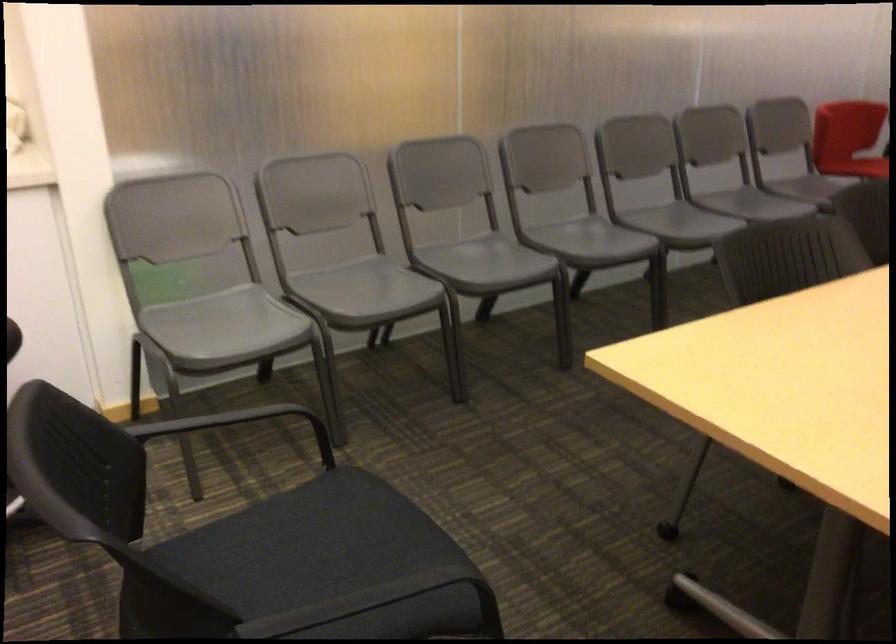
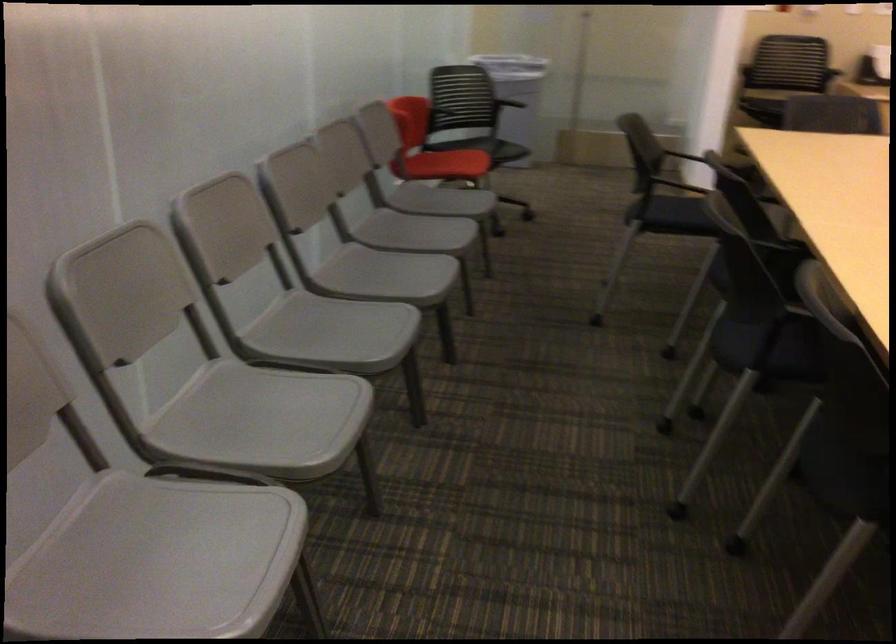
Find the pixel in the second image that matches (688,223) in the first image.

(385, 275)